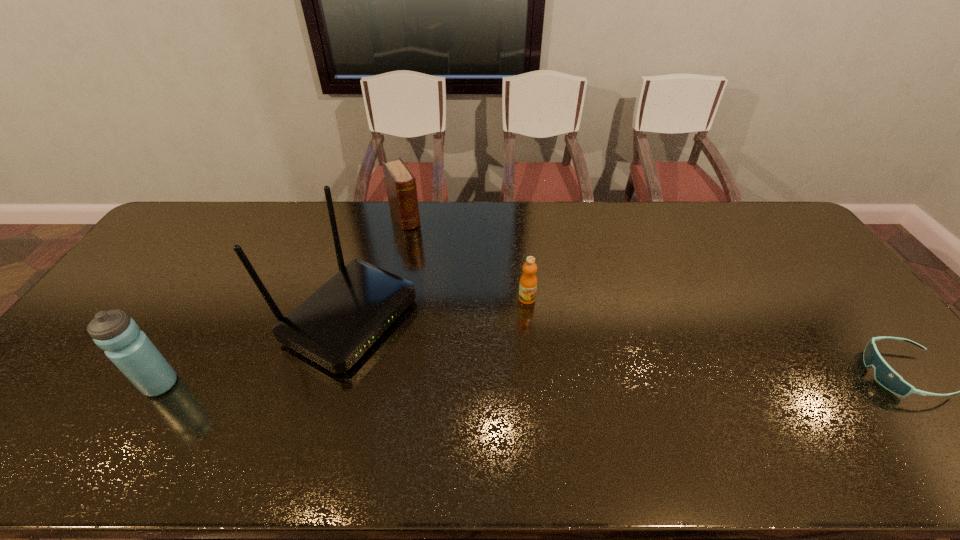
Find the location of a particular element. The width and height of the screenshot is (960, 540). vacant space located on the front-facing side of the router is located at coordinates (533, 414).

Where is `free spot located on the spine side of the diary`? This screenshot has height=540, width=960. free spot located on the spine side of the diary is located at coordinates click(416, 238).

What are the coordinates of `vacant space located on the spine side of the diary` in the screenshot? It's located at (429, 260).

In order to click on free space located 0.320m on the spine side of the diary in this screenshot , I will do `click(446, 288)`.

Find the location of a particular element. This screenshot has width=960, height=540. vacant space located on the front label of the orange juice is located at coordinates (540, 378).

This screenshot has height=540, width=960. Find the location of `free space located on the front label of the orange juice`. free space located on the front label of the orange juice is located at coordinates (536, 352).

Find the location of `free space located on the front label of the orange juice`. free space located on the front label of the orange juice is located at coordinates (543, 399).

This screenshot has width=960, height=540. I want to click on object positioned at the far edge, so click(400, 182).

Find the location of `object located in the near edge section of the desktop`. object located in the near edge section of the desktop is located at coordinates (132, 352).

The width and height of the screenshot is (960, 540). In the image, there is a desktop. What are the coordinates of `free region at the far edge` in the screenshot? It's located at pyautogui.click(x=231, y=220).